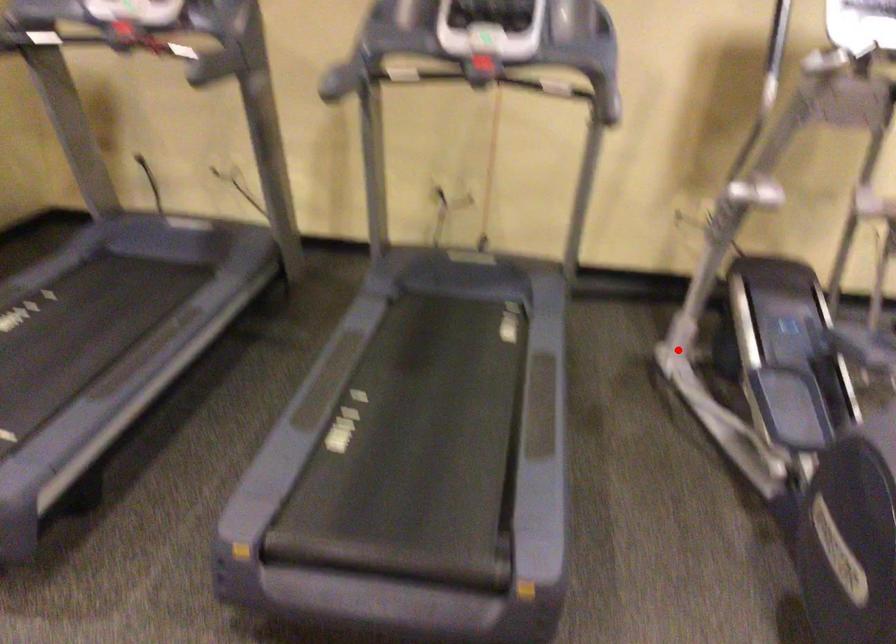
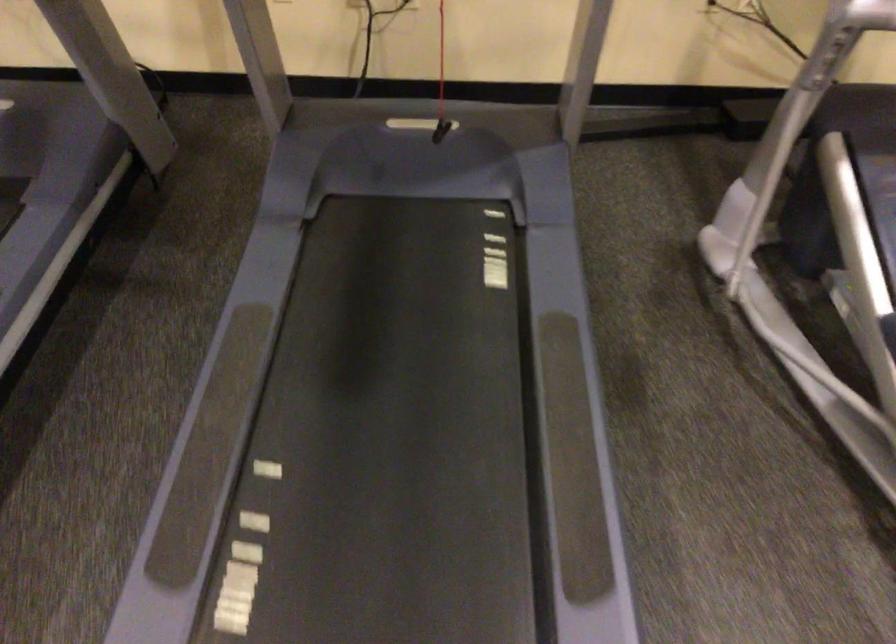
Question: I am providing you with two images of the same scene from different viewpoints. In image1, a red point is highlighted. Considering the same 3D point in image2, which of the following is correct?

Choices:
 (A) It is closer
 (B) It is farther

Answer: (A)